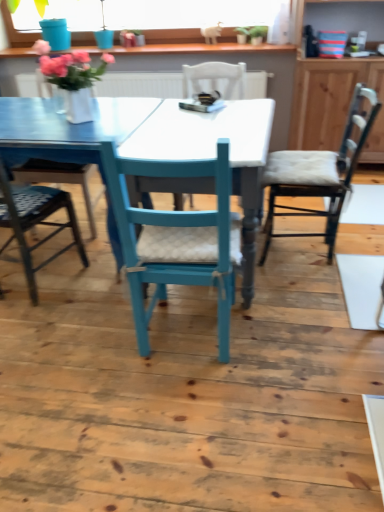
From the picture: What is the approximate height of wooden textured chair at right, which is the first chair in right-to-left order?

wooden textured chair at right, which is the first chair in right-to-left order, is 86.55 centimeters tall.

Image resolution: width=384 pixels, height=512 pixels. What do you see at coordinates (60, 180) in the screenshot? I see `matte blue swivel chair at left` at bounding box center [60, 180].

Image resolution: width=384 pixels, height=512 pixels. Describe the element at coordinates (334, 103) in the screenshot. I see `wooden cabinet at right` at that location.

You are a GUI agent. You are given a task and a screenshot of the screen. Output one action in this format:
    pyautogui.click(x=<x>, y=<y>)
    Task: Click on the green matte plant at upper center
    This screenshot has width=384, height=512.
    Given the screenshot: What is the action you would take?
    pyautogui.click(x=257, y=34)

Identify the location of teal painted wood chair at center, which is the 2th chair from right to left. (177, 239).

In the scene shown: Is wooden textured chair at right, which is the first chair in right-to-left order, far away from wooden cabinet at right?

No.

How many degrees apart are the facing directions of wooden textured chair at right, which is the first chair in right-to-left order, and wooden cabinet at right?

90.3 degrees.

Measure the distance from wooden textured chair at right, which appears as the third chair when viewed from the left, to wooden cabinet at right.

The distance of wooden textured chair at right, which appears as the third chair when viewed from the left, from wooden cabinet at right is 25.18 inches.

Would you say wooden textured chair at right, which is the first chair in right-to-left order, contains wooden cabinet at right?

No, wooden cabinet at right is not surrounded by wooden textured chair at right, which is the first chair in right-to-left order.

Is green matte plant at upper center oriented towards wooden cabinet at right?

No, green matte plant at upper center does not turn towards wooden cabinet at right.

In the scene shown: Considering their positions, is green matte plant at upper center located in front of or behind wooden cabinet at right?

In the image, green matte plant at upper center appears behind wooden cabinet at right.

From a real-world perspective, between green matte plant at upper center and wooden cabinet at right, who is vertically higher?

green matte plant at upper center.

Is green matte plant at upper center with wooden cabinet at right?

No, green matte plant at upper center is not touching wooden cabinet at right.

Which of these two, matte blue swivel chair at left or teal painted wood chair at center, which is the 2th chair from right to left, stands shorter?

matte blue swivel chair at left is shorter.

How distant is matte blue swivel chair at left from teal painted wood chair at center, acting as the second chair starting from the left?

matte blue swivel chair at left and teal painted wood chair at center, acting as the second chair starting from the left, are 39.36 inches apart from each other.

The height and width of the screenshot is (512, 384). What are the coordinates of `swivel chair located behind the teal painted wood chair at center, acting as the second chair starting from the left` in the screenshot? It's located at (60, 180).

Considering the positions of points (255, 34) and (134, 243), is point (255, 34) closer to camera compared to point (134, 243)?

No, (255, 34) is behind (134, 243).

Looking at this image, are green matte plant at upper center and teal painted wood chair at center, which is the 2th chair from right to left, far apart?

Absolutely, green matte plant at upper center is distant from teal painted wood chair at center, which is the 2th chair from right to left.

How different are the orientations of green matte plant at upper center and teal painted wood chair at center, which is the 2th chair from right to left, in degrees?

The facing directions of green matte plant at upper center and teal painted wood chair at center, which is the 2th chair from right to left, are 180 degrees apart.

Looking at their sizes, would you say green matte plant at upper center is wider or thinner than teal painted wood chair at center, acting as the second chair starting from the left?

green matte plant at upper center is thinner than teal painted wood chair at center, acting as the second chair starting from the left.

From the image's perspective, starting from the wooden textured chair at right, which appears as the third chair when viewed from the left, which chair is the 1st one below? Please provide its 2D coordinates.

[(35, 222)]

In the scene shown: Would you say wooden textured chair at right, which is the first chair in right-to-left order, is inside or outside metallic silver chair at left, which is counted as the first chair, starting from the left?

wooden textured chair at right, which is the first chair in right-to-left order, is outside metallic silver chair at left, which is counted as the first chair, starting from the left.

From the image's perspective, is wooden textured chair at right, which is the first chair in right-to-left order, located above metallic silver chair at left, which is counted as the first chair, starting from the left?

Indeed, from the image's perspective, wooden textured chair at right, which is the first chair in right-to-left order, is shown above metallic silver chair at left, which is counted as the first chair, starting from the left.

How much distance is there between wooden textured chair at right, which is the first chair in right-to-left order, and metallic silver chair at left, which is counted as the first chair, starting from the left?

wooden textured chair at right, which is the first chair in right-to-left order, and metallic silver chair at left, which is counted as the first chair, starting from the left, are 1.23 meters apart.

Which is more to the left, metallic silver chair at left, which is counted as the first chair, starting from the left, or green matte plant at upper center?

From the viewer's perspective, metallic silver chair at left, which is counted as the first chair, starting from the left, appears more on the left side.

Is metallic silver chair at left, the third chair when ordered from right to left, positioned with its back to green matte plant at upper center?

No, green matte plant at upper center is not at the back of metallic silver chair at left, the third chair when ordered from right to left.

Is metallic silver chair at left, the third chair when ordered from right to left, thinner than green matte plant at upper center?

Incorrect, the width of metallic silver chair at left, the third chair when ordered from right to left, is not less than that of green matte plant at upper center.

From a real-world perspective, is teal painted wood chair at center, which is the 2th chair from right to left, over green matte plant at upper center?

Incorrect, from a real-world perspective, teal painted wood chair at center, which is the 2th chair from right to left, is lower than green matte plant at upper center.

From the image's perspective, is teal painted wood chair at center, acting as the second chair starting from the left, beneath green matte plant at upper center?

Correct, teal painted wood chair at center, acting as the second chair starting from the left, appears lower than green matte plant at upper center in the image.

Is teal painted wood chair at center, which is the 2th chair from right to left, situated inside green matte plant at upper center or outside?

teal painted wood chair at center, which is the 2th chair from right to left, is located beyond the bounds of green matte plant at upper center.

The height and width of the screenshot is (512, 384). Find the location of `dresser behind the wooden textured chair at right, which appears as the third chair when viewed from the left`. dresser behind the wooden textured chair at right, which appears as the third chair when viewed from the left is located at coordinates (334, 103).

Where is `houseplant positioned vertically above the wooden cabinet at right (from a real-world perspective)`? This screenshot has width=384, height=512. houseplant positioned vertically above the wooden cabinet at right (from a real-world perspective) is located at coordinates (257, 34).

When comparing their distances from teal painted wood chair at center, which is the 2th chair from right to left, does wooden textured chair at right, which appears as the third chair when viewed from the left, or matte blue swivel chair at left seem further?

matte blue swivel chair at left.

Considering their positions, is metallic silver chair at left, the third chair when ordered from right to left, positioned further to wooden cabinet at right than wooden textured chair at right, which is the first chair in right-to-left order?

The object further to wooden cabinet at right is metallic silver chair at left, the third chair when ordered from right to left.

Estimate the real-world distances between objects in this image. Which object is closer to green matte plant at upper center, teal painted wood chair at center, which is the 2th chair from right to left, or metallic silver chair at left, which is counted as the first chair, starting from the left?

metallic silver chair at left, which is counted as the first chair, starting from the left, lies closer to green matte plant at upper center than the other object.

Which object lies further to the anchor point wooden cabinet at right, teal painted wood chair at center, acting as the second chair starting from the left, or wooden textured chair at right, which appears as the third chair when viewed from the left?

The object further to wooden cabinet at right is teal painted wood chair at center, acting as the second chair starting from the left.

From the image, which object appears to be nearer to matte blue swivel chair at left, metallic silver chair at left, which is counted as the first chair, starting from the left, or wooden textured chair at right, which is the first chair in right-to-left order?

metallic silver chair at left, which is counted as the first chair, starting from the left, is closer to matte blue swivel chair at left.

Looking at the image, which one is located closer to wooden cabinet at right, green matte plant at upper center or teal painted wood chair at center, which is the 2th chair from right to left?

Among the two, green matte plant at upper center is located nearer to wooden cabinet at right.

From the image, which object appears to be nearer to matte blue swivel chair at left, wooden textured chair at right, which appears as the third chair when viewed from the left, or wooden cabinet at right?

wooden textured chair at right, which appears as the third chair when viewed from the left, lies closer to matte blue swivel chair at left than the other object.

Considering their positions, is wooden cabinet at right positioned further to metallic silver chair at left, which is counted as the first chair, starting from the left, than matte blue swivel chair at left?

wooden cabinet at right.

Image resolution: width=384 pixels, height=512 pixels. I want to click on swivel chair between metallic silver chair at left, which is counted as the first chair, starting from the left, and wooden cabinet at right from left to right, so click(60, 180).

What are the coordinates of `swivel chair between metallic silver chair at left, which is counted as the first chair, starting from the left, and green matte plant at upper center from front to back` in the screenshot? It's located at (60, 180).

Where is `dresser positioned between teal painted wood chair at center, acting as the second chair starting from the left, and green matte plant at upper center from near to far`? dresser positioned between teal painted wood chair at center, acting as the second chair starting from the left, and green matte plant at upper center from near to far is located at coordinates (334, 103).

I want to click on chair between metallic silver chair at left, the third chair when ordered from right to left, and green matte plant at upper center, along the z-axis, so click(x=318, y=174).